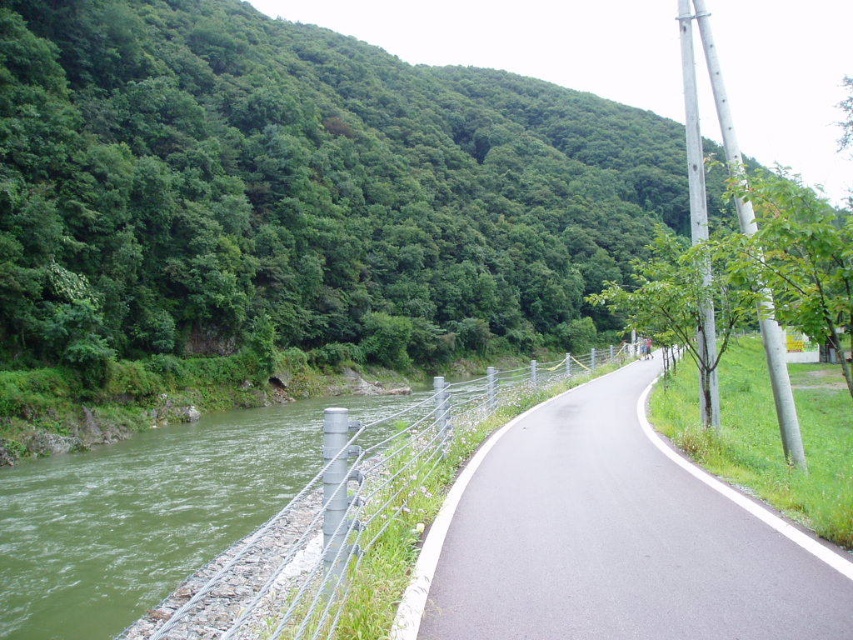
You are a hiker planning to take a photo of the green leafy hillside at upper left and the black asphalt road at center. Which object should you focus on first if you want to capture both in a single frame without moving your camera?

The green leafy hillside at upper left should be focused on first since it has a larger size compared to the black asphalt road at center, making it the dominant subject in the frame.

You are a hiker planning to take a photo of the green leafy hillside at upper left and the green gravel river at left. Which object should you focus on first if you want to capture both in a single frame without moving the camera?

The green leafy hillside at upper left is positioned on the right side of the green gravel river at left. To capture both in a single frame without moving the camera, focus on the green gravel river at left first since it is on the left side of the hillside.

You are standing at the point indicated by point (299,195) in the image. What do you see in the direction of the river flowing from the left towards the center?

The point (299,195) indicates a green leafy hillside at upper left, so looking towards the river flowing from the left towards the center, you would see the river curving along the edge of the hillside.